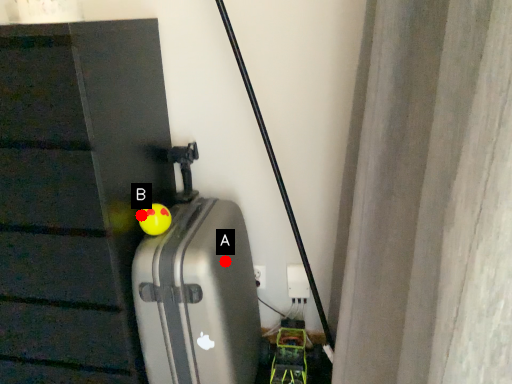
Question: Two points are circled on the image, labeled by A and B beside each circle. Which of the following is the closest to the observer?

Choices:
 (A) A is closer
 (B) B is closer

Answer: (B)